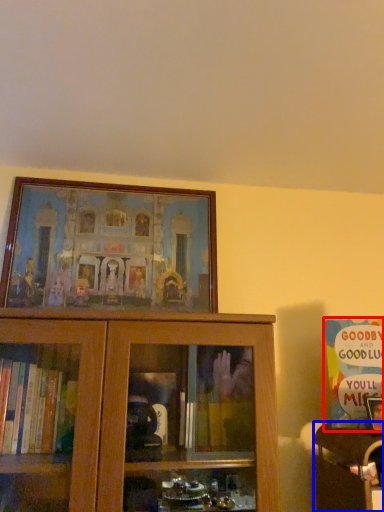
Question: Which object appears closest to the camera in this image, book (highlighted by a red box) or furniture (highlighted by a blue box)?

Choices:
 (A) book
 (B) furniture

Answer: (B)